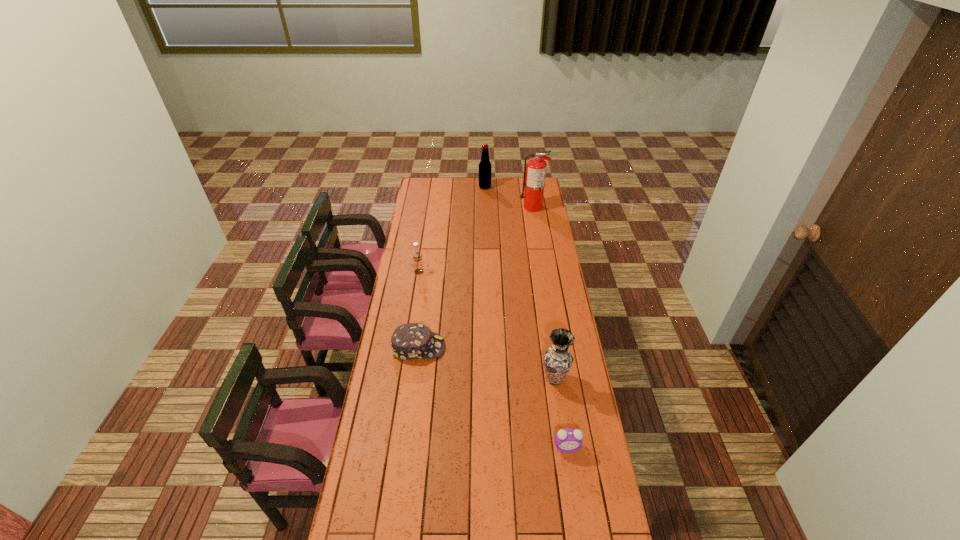
This screenshot has width=960, height=540. I want to click on the second farthest object, so click(535, 170).

I want to click on the tallest object, so click(535, 170).

Locate an element on the screen. beer bottle is located at coordinates (485, 166).

The height and width of the screenshot is (540, 960). Identify the location of the third object from left to right. (485, 166).

Locate an element on the screen. the second nearest object is located at coordinates (557, 360).

At what (x,y) coordinates should I click in order to perform the action: click on the fourth tallest object. Please return your answer as a coordinate pair (x, y). Looking at the image, I should click on (417, 258).

Identify the location of vodka. The height and width of the screenshot is (540, 960). (417, 258).

This screenshot has width=960, height=540. I want to click on the third nearest object, so click(410, 341).

I want to click on alarm clock, so click(x=567, y=440).

The height and width of the screenshot is (540, 960). Identify the location of free space located 0.380m at the nozzle of the fire extinguisher. (458, 207).